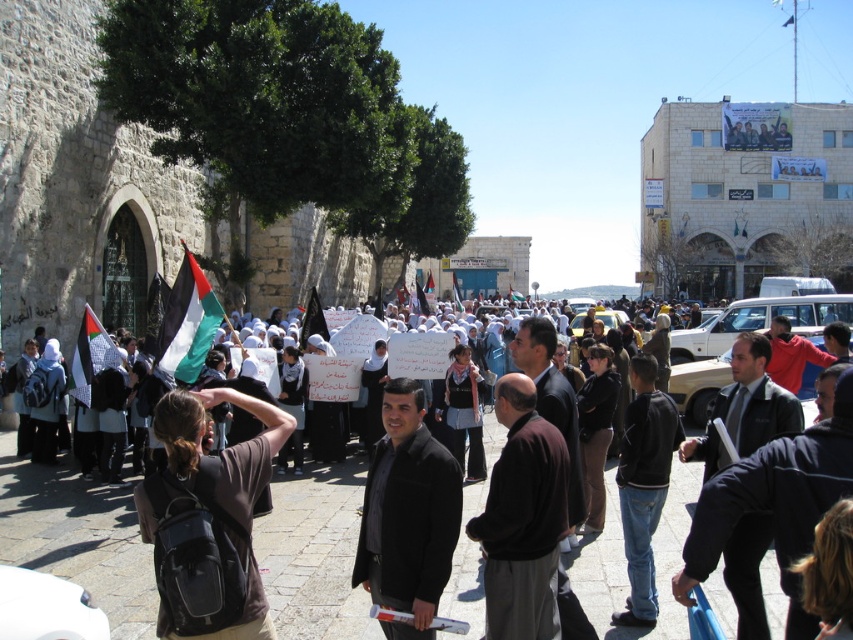
Is brown matte jacket at center above dark suit at center?

Actually, brown matte jacket at center is below dark suit at center.

Consider the image. Is brown matte jacket at center smaller than dark suit at center?

No.

Who is more forward, (x=540, y=541) or (x=764, y=506)?

Positioned in front is point (x=764, y=506).

What are the coordinates of `brown matte jacket at center` in the screenshot? It's located at (521, 518).

Can you confirm if black and white flag at center is wider than red cotton shirt at center?

In fact, black and white flag at center might be narrower than red cotton shirt at center.

Consider the image. Does black and white flag at center have a lesser height compared to red cotton shirt at center?

Incorrect, black and white flag at center's height does not fall short of red cotton shirt at center's.

What do you see at coordinates (186, 324) in the screenshot? I see `black and white flag at center` at bounding box center [186, 324].

I want to click on black and white flag at center, so click(x=186, y=324).

Measure the distance between point (796,435) and camera.

22.71 meters

Consider the image. Who is taller, dark suit at center or black and white flag at center?

Standing taller between the two is black and white flag at center.

This screenshot has height=640, width=853. Identify the location of dark suit at center. (775, 502).